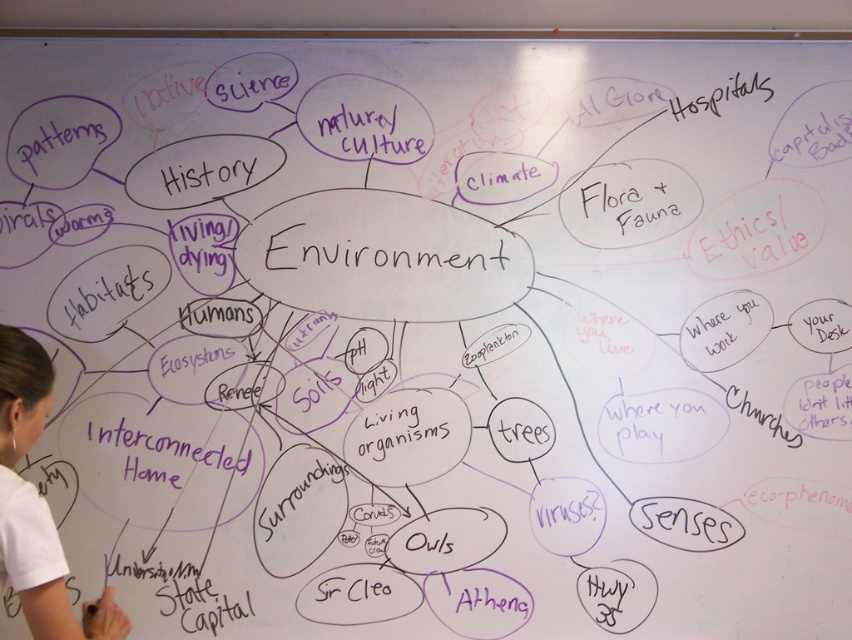
From the picture: Does white t-shirt at lower left appear under black marker text at lower left?

No, white t-shirt at lower left is not below black marker text at lower left.

Between white t-shirt at lower left and black marker text at lower left, which one has less height?

With less height is black marker text at lower left.

Is point (33, 564) positioned behind point (222, 611)?

No, (33, 564) is closer to viewer.

Identify the location of white t-shirt at lower left. Image resolution: width=852 pixels, height=640 pixels. (36, 504).